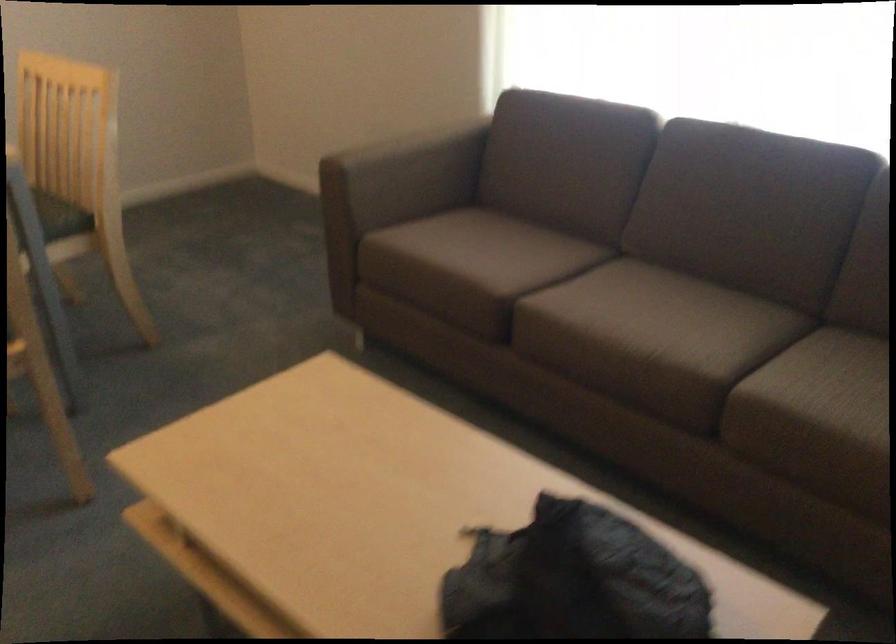
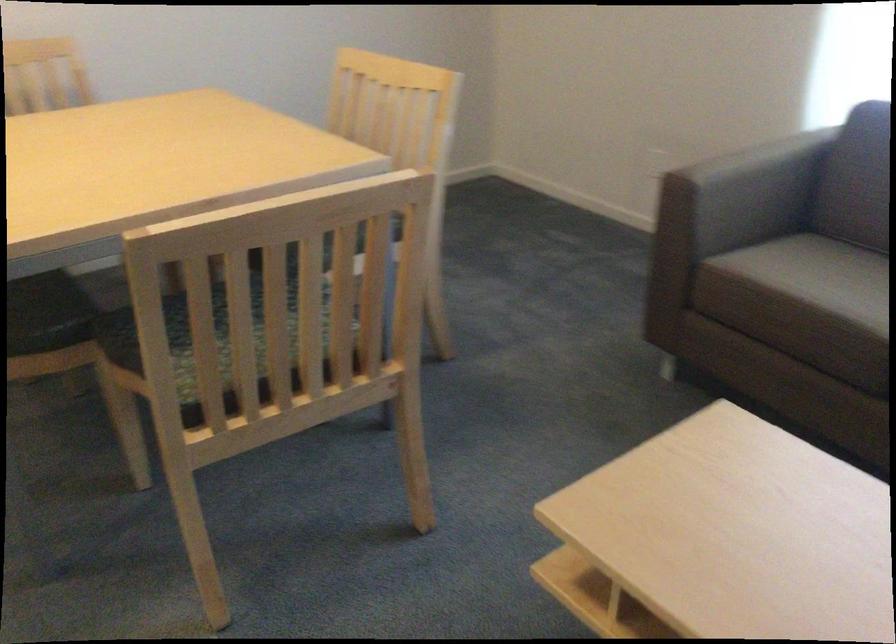
Question: The images are taken continuously from a first-person perspective. In which direction is your viewpoint rotating?

Choices:
 (A) Left
 (B) Right
 (C) Up
 (D) Down

Answer: (A)